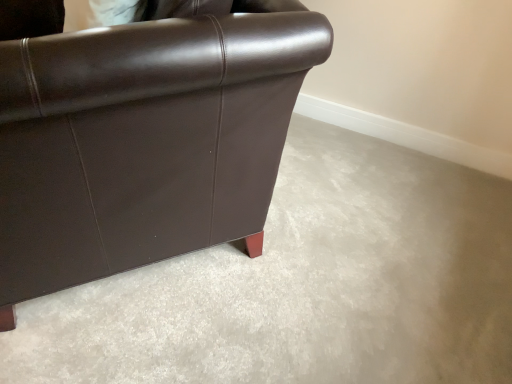
Question: Visually, is brown leather couch at left positioned to the left or to the right of matte brown leather chair at upper left?

Choices:
 (A) right
 (B) left

Answer: (A)

Question: Considering the positions of brown leather couch at left and matte brown leather chair at upper left in the image, is brown leather couch at left wider or thinner than matte brown leather chair at upper left?

Choices:
 (A) wide
 (B) thin

Answer: (A)

Question: Is point (510, 236) positioned closer to the camera than point (12, 86)?

Choices:
 (A) closer
 (B) farther

Answer: (B)

Question: Is matte brown leather chair at upper left in front of or behind brown leather couch at left in the image?

Choices:
 (A) front
 (B) behind

Answer: (A)

Question: From their relative heights in the image, would you say matte brown leather chair at upper left is taller or shorter than brown leather couch at left?

Choices:
 (A) tall
 (B) short

Answer: (A)

Question: Is matte brown leather chair at upper left to the left or to the right of brown leather couch at left in the image?

Choices:
 (A) right
 (B) left

Answer: (B)

Question: Is matte brown leather chair at upper left bigger or smaller than brown leather couch at left?

Choices:
 (A) big
 (B) small

Answer: (A)